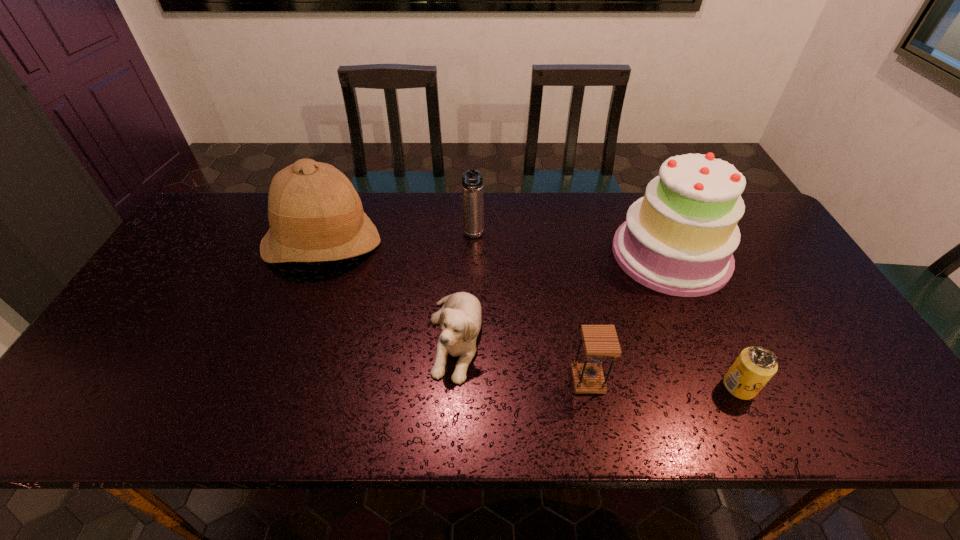
The image size is (960, 540). I want to click on vacant area at the near left corner, so click(x=91, y=400).

This screenshot has width=960, height=540. What are the coordinates of `vacant area that lies between the hat and the cake` in the screenshot? It's located at (496, 248).

You are a GUI agent. You are given a task and a screenshot of the screen. Output one action in this format:
    pyautogui.click(x=<x>, y=<y>)
    Task: Click on the free space that is in between the hat and the thermos bottle
    The height and width of the screenshot is (540, 960).
    Given the screenshot: What is the action you would take?
    pyautogui.click(x=397, y=239)

At what (x,y) coordinates should I click in order to perform the action: click on free space that is in between the beer can and the cake. Please return your answer as a coordinate pair (x, y). Looking at the image, I should click on (706, 320).

Where is `vacant space that is in between the thermos bottle and the puppy`? vacant space that is in between the thermos bottle and the puppy is located at coordinates (465, 287).

You are a GUI agent. You are given a task and a screenshot of the screen. Output one action in this format:
    pyautogui.click(x=<x>, y=<y>)
    Task: Click on the vacant area that lies between the thermos bottle and the beer can
    The width and height of the screenshot is (960, 540).
    Given the screenshot: What is the action you would take?
    pyautogui.click(x=607, y=311)

Find the location of a particular element. free space between the thermos bottle and the puppy is located at coordinates (465, 287).

The image size is (960, 540). Identify the location of vacant region between the thermos bottle and the cake. (572, 245).

This screenshot has height=540, width=960. In order to click on free space between the thermos bottle and the cake in this screenshot , I will do `click(572, 245)`.

Identify the location of free area in between the beer can and the cake. (706, 320).